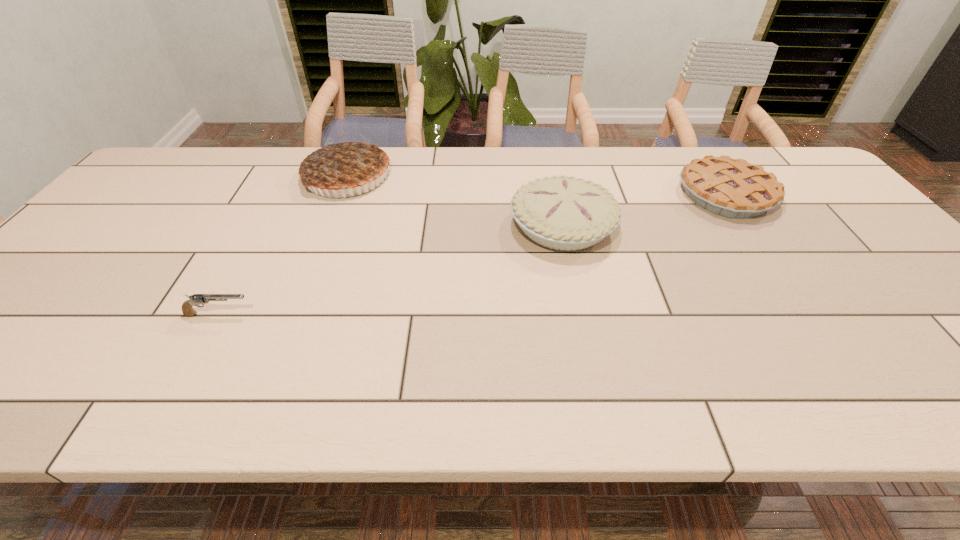
In order to click on blank area in the image that satisfies the following two spatial constraints: 1. on the front side of the tallest object; 2. on the right side of the rightmost object in this screenshot , I will do `click(340, 194)`.

Find the location of a particular element. This screenshot has width=960, height=540. free spot that satisfies the following two spatial constraints: 1. on the front side of the shortest pie; 2. on the left side of the tallest pie is located at coordinates [340, 194].